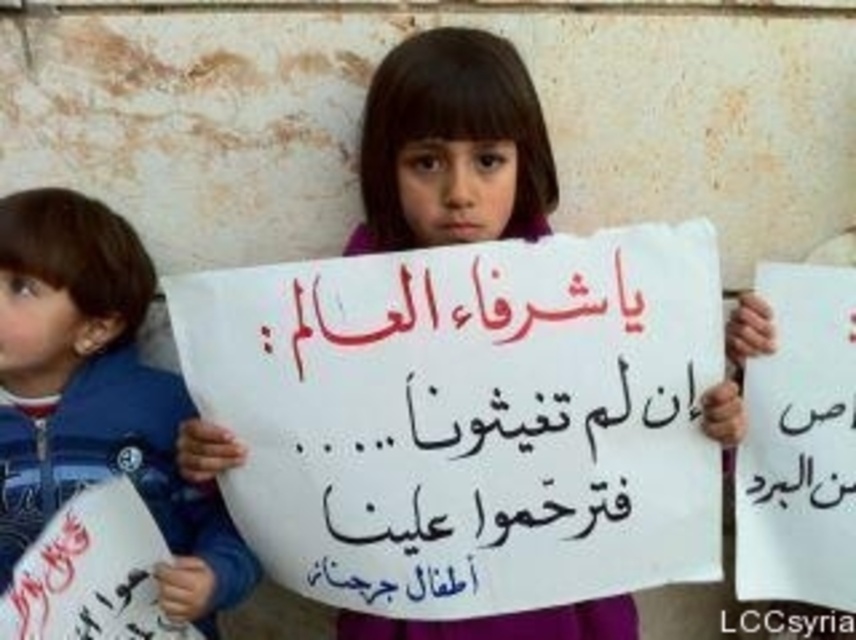
Measure the distance between blue fleece jacket at left and white paper at right.

blue fleece jacket at left is 94.82 centimeters from white paper at right.

Is blue fleece jacket at left bigger than white paper at right?

Indeed, blue fleece jacket at left has a larger size compared to white paper at right.

Is point (34, 248) positioned behind point (819, 465)?

No.

Identify the location of blue fleece jacket at left. The height and width of the screenshot is (640, 856). (96, 396).

Between blue fleece jacket at left and white paper sign at center, which one is positioned higher?

white paper sign at center

Looking at this image, how much distance is there between blue fleece jacket at left and white paper sign at center?

A distance of 20.25 inches exists between blue fleece jacket at left and white paper sign at center.

Identify the location of blue fleece jacket at left. The image size is (856, 640). (96, 396).

Does white paper sign at center lie behind white paper at right?

No, it is in front of white paper at right.

Where is `white paper sign at center`? This screenshot has height=640, width=856. white paper sign at center is located at coordinates (452, 147).

Is point (506, 145) positioned before point (821, 525)?

Yes, point (506, 145) is closer to viewer.

Identify the location of white paper sign at center. (452, 147).